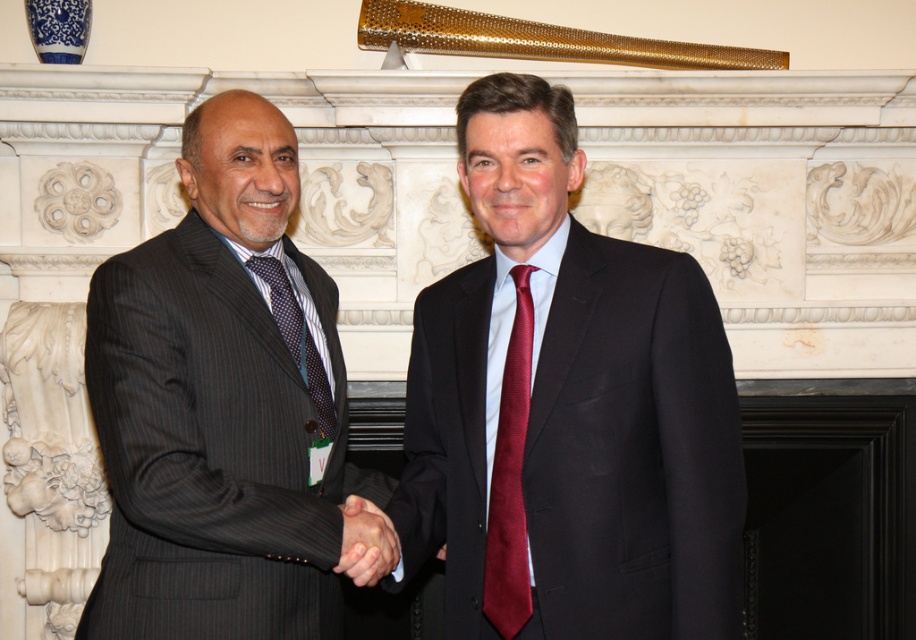
Question: Which object appears closest to the camera in this image?

Choices:
 (A) dark blue textured tie at left
 (B) smooth black suit at center
 (C) matte black suit at center

Answer: (C)

Question: Does dark pinstripe suit at left have a lesser width compared to maroon silk tie at center?

Choices:
 (A) no
 (B) yes

Answer: (A)

Question: Does matte black suit at center come behind dark blue textured tie at left?

Choices:
 (A) no
 (B) yes

Answer: (A)

Question: Which point is farther to the camera?

Choices:
 (A) matte black suit at center
 (B) dark pinstripe suit at left

Answer: (A)

Question: Which point appears farthest from the camera in this image?

Choices:
 (A) (224, 237)
 (B) (726, 547)

Answer: (A)

Question: Is matte black suit at center to the right of dark blue textured tie at left from the viewer's perspective?

Choices:
 (A) yes
 (B) no

Answer: (A)